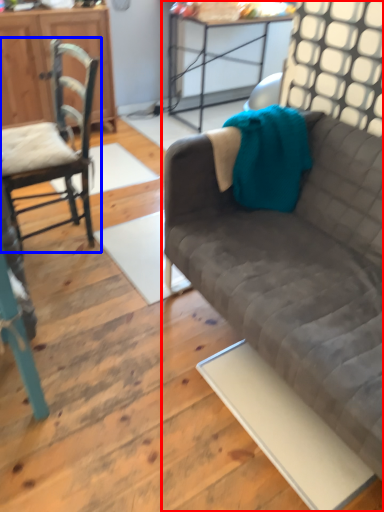
Question: Among these objects, which one is nearest to the camera, studio couch (highlighted by a red box) or chair (highlighted by a blue box)?

Choices:
 (A) studio couch
 (B) chair

Answer: (A)